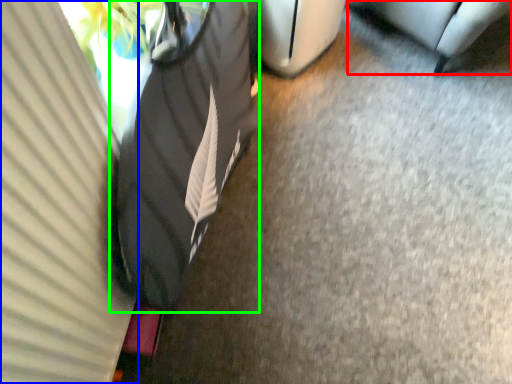
Question: Estimate the real-world distances between objects in this image. Which object is closer to furniture (highlighted by a red box), curtain (highlighted by a blue box) or bean bag chair (highlighted by a green box)?

Choices:
 (A) curtain
 (B) bean bag chair

Answer: (B)